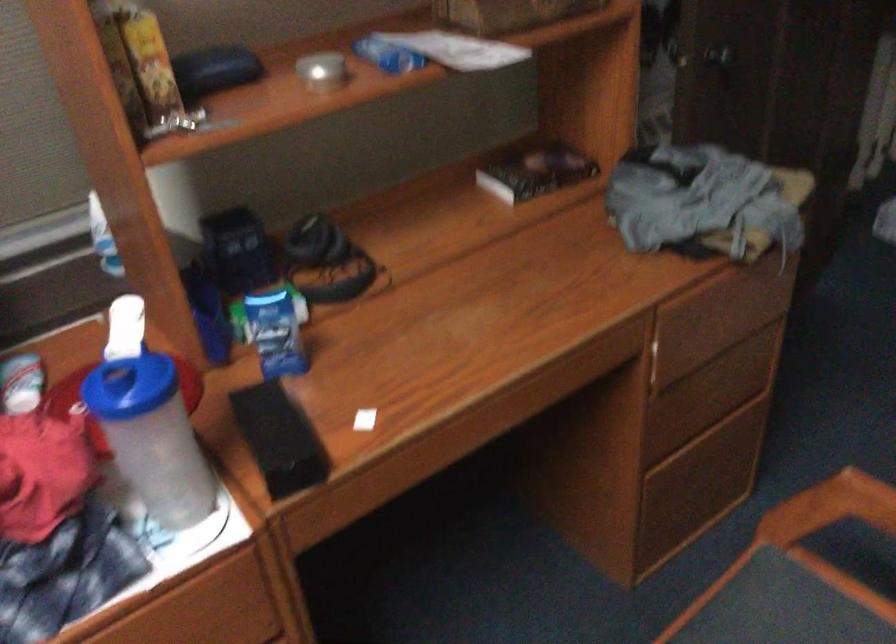
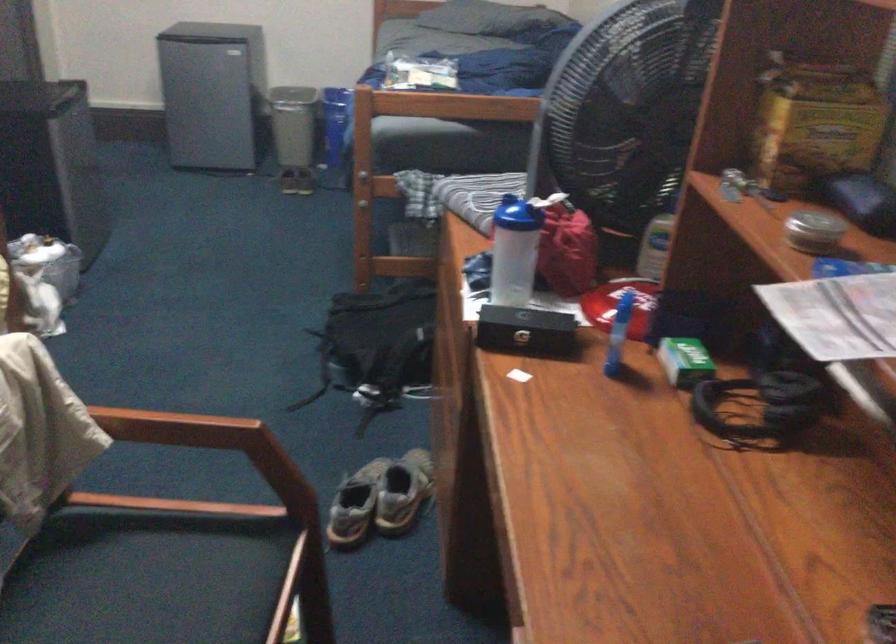
Where in the second image is the point corresponding to (x=277, y=421) from the first image?

(526, 330)